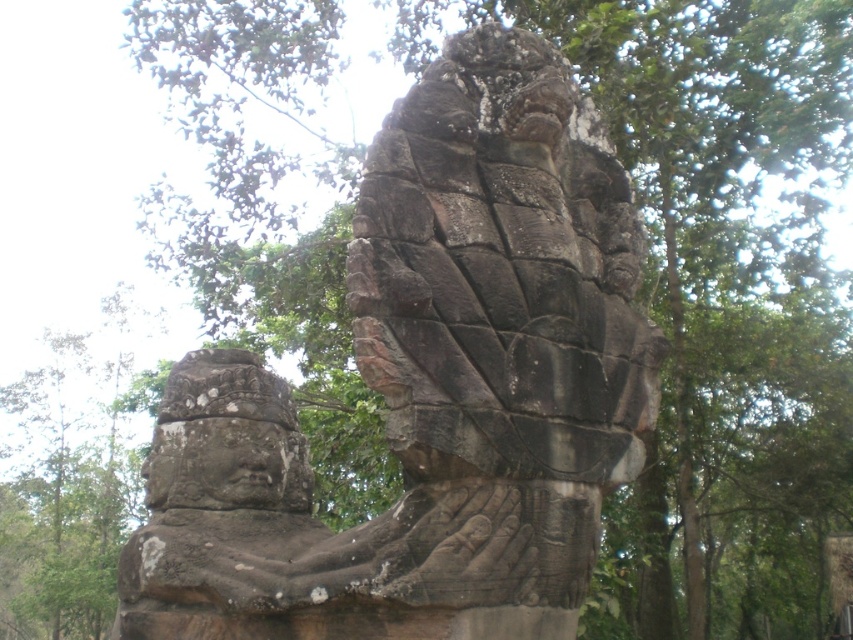
Can you confirm if rough stone sculpture at center is taller than rough stone face at center?

Yes, rough stone sculpture at center is taller than rough stone face at center.

Can you confirm if rough stone sculpture at center is positioned to the right of rough stone face at center?

Correct, you'll find rough stone sculpture at center to the right of rough stone face at center.

Between point (399, 362) and point (281, 484), which one is positioned behind?

Positioned behind is point (281, 484).

Where is `rough stone sculpture at center`? The image size is (853, 640). rough stone sculpture at center is located at coordinates (439, 384).